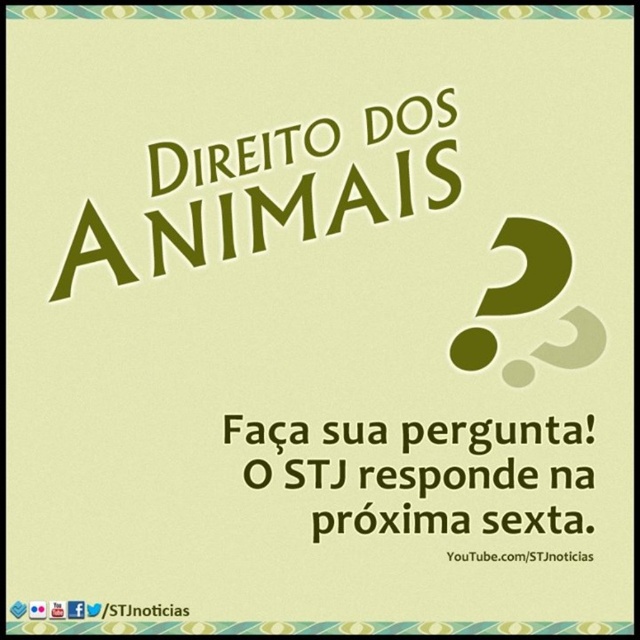
Question: Considering the real-world distances, which object is farthest from the black paper at lower left?

Choices:
 (A) whitetexturl at center
 (B) green textured sign at upper center
 (C) green matte question mark at center

Answer: (C)

Question: Does green matte letter a at upper left have a larger size compared to black paper at lower left?

Choices:
 (A) no
 (B) yes

Answer: (B)

Question: Which object is positioned closest to the green textured sign at upper center?

Choices:
 (A) whitetexturl at center
 (B) black paper at lower left
 (C) white paper text at center
 (D) green matte question mark at center

Answer: (D)

Question: Considering the relative positions of white paper text at center and green matte letter a at upper left in the image provided, where is white paper text at center located with respect to green matte letter a at upper left?

Choices:
 (A) left
 (B) right

Answer: (B)

Question: Where is green textured sign at upper center located in relation to white paper text at center in the image?

Choices:
 (A) below
 (B) above

Answer: (B)

Question: Which of these objects is positioned closest to the black paper at lower left?

Choices:
 (A) green textured sign at upper center
 (B) green matte question mark at center
 (C) green matte letter a at upper left

Answer: (C)